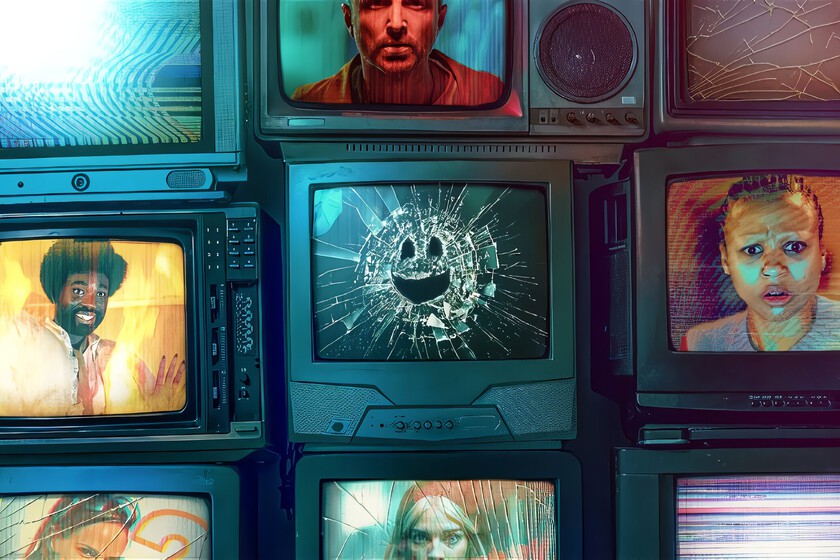
Locate an element on the screen. televisions is located at coordinates (103, 550), (139, 382), (365, 262), (449, 536), (715, 508), (811, 189), (424, 77), (84, 76), (775, 51).